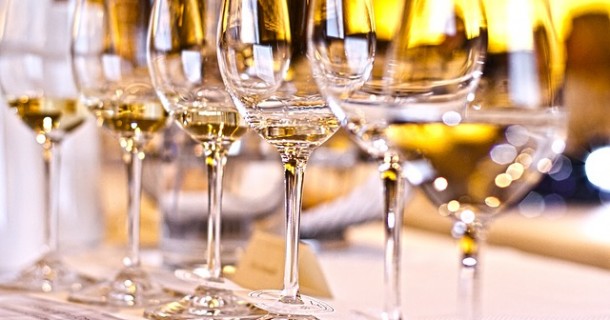
Where is `wine glasses`? This screenshot has width=610, height=320. wine glasses is located at coordinates (29, 75), (118, 79), (180, 71), (260, 55), (343, 80), (476, 81).